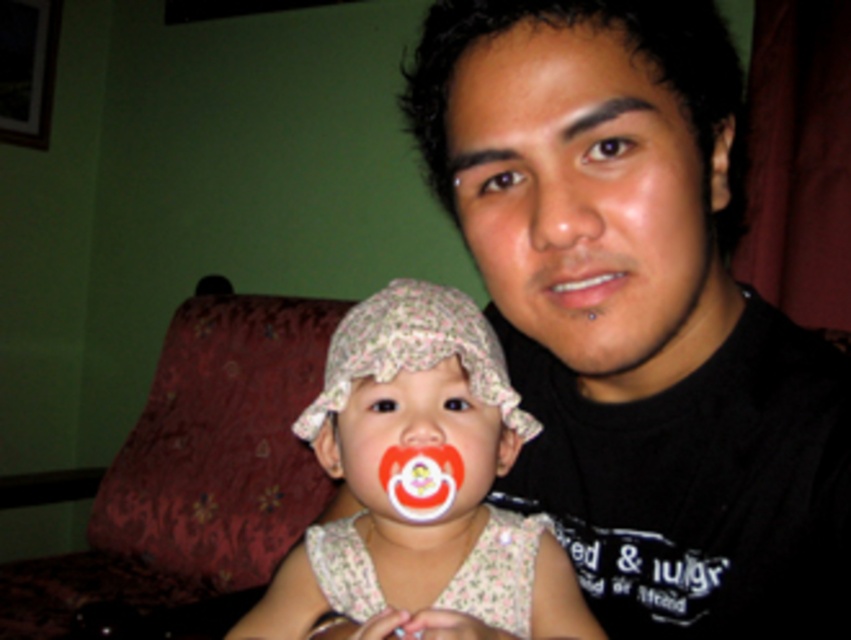
Question: Does floral fabric baby hat at center appear over matte white teeth at center?

Choices:
 (A) no
 (B) yes

Answer: (A)

Question: Is matte white teeth at center in front of matte plastic pacifier at center?

Choices:
 (A) yes
 (B) no

Answer: (A)

Question: Which object is positioned farthest from the matte white teeth at center?

Choices:
 (A) matte black shirt at center
 (B) matte skin nose at center
 (C) matte plastic pacifier at center

Answer: (A)

Question: Which of these objects is positioned farthest from the matte skin nose at center?

Choices:
 (A) matte plastic pacifier at center
 (B) matte black shirt at center
 (C) matte white teeth at center
 (D) floral fabric baby hat at center

Answer: (D)

Question: Which of the following is the closest to the observer?

Choices:
 (A) (553, 10)
 (B) (410, 416)
 (C) (550, 230)
 (D) (623, 275)

Answer: (C)

Question: From the image, what is the correct spatial relationship of floral fabric baby hat at center in relation to matte white teeth at center?

Choices:
 (A) above
 (B) below

Answer: (B)